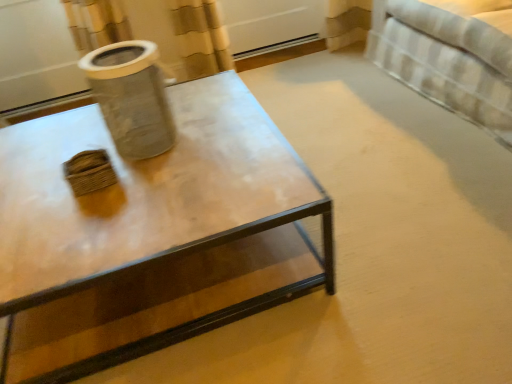
Find the location of a particular element. The height and width of the screenshot is (384, 512). white striped fabric bed at upper right is located at coordinates (450, 55).

What do you see at coordinates (450, 55) in the screenshot? I see `white striped fabric bed at upper right` at bounding box center [450, 55].

Describe the element at coordinates (151, 234) in the screenshot. This screenshot has width=512, height=384. I see `matte glass coffee table at center` at that location.

Locate an element on the screen. white striped fabric bed at upper right is located at coordinates (450, 55).

Between clear glass jar at upper left and white striped fabric bed at upper right, which one has larger size?

white striped fabric bed at upper right is bigger.

The height and width of the screenshot is (384, 512). I want to click on vase that appears on the left of white striped fabric bed at upper right, so pos(131,97).

Considering the positions of objects clear glass jar at upper left and white striped fabric bed at upper right in the image provided, who is behind, clear glass jar at upper left or white striped fabric bed at upper right?

white striped fabric bed at upper right is behind.

Is clear glass jar at upper left positioned beyond the bounds of white striped fabric bed at upper right?

Yes, clear glass jar at upper left is located beyond the bounds of white striped fabric bed at upper right.

Is matte glass coffee table at center oriented away from clear glass jar at upper left?

That's not correct — matte glass coffee table at center is not looking away from clear glass jar at upper left.

Are matte glass coffee table at center and clear glass jar at upper left beside each other?

No, matte glass coffee table at center is not with clear glass jar at upper left.

What are the coordinates of `coffee table below the clear glass jar at upper left (from a real-world perspective)` in the screenshot? It's located at (151, 234).

How many degrees apart are the facing directions of matte glass coffee table at center and clear glass jar at upper left?

There is a 0.149-degree angle between the facing directions of matte glass coffee table at center and clear glass jar at upper left.

From the image's perspective, is matte glass coffee table at center located above white striped fabric bed at upper right?

No.

Does point (101, 217) come in front of point (416, 1)?

That is True.

Considering the relative sizes of matte glass coffee table at center and white striped fabric bed at upper right in the image provided, is matte glass coffee table at center smaller than white striped fabric bed at upper right?

Yes.

Considering the relative sizes of matte glass coffee table at center and white striped fabric bed at upper right in the image provided, is matte glass coffee table at center wider than white striped fabric bed at upper right?

Indeed, matte glass coffee table at center has a greater width compared to white striped fabric bed at upper right.

Based on the photo, considering the relative sizes of white striped fabric bed at upper right and matte glass coffee table at center in the image provided, is white striped fabric bed at upper right shorter than matte glass coffee table at center?

No, white striped fabric bed at upper right is not shorter than matte glass coffee table at center.

Is white striped fabric bed at upper right smaller than matte glass coffee table at center?

No.

Does point (486, 6) come in front of point (23, 322)?

No, (486, 6) is behind (23, 322).

Does clear glass jar at upper left turn towards matte glass coffee table at center?

No, clear glass jar at upper left is not oriented towards matte glass coffee table at center.

Is clear glass jar at upper left wider than matte glass coffee table at center?

No.

Find the location of a particular element. coffee table on the right side of clear glass jar at upper left is located at coordinates (151, 234).

From the image's perspective, who appears lower, clear glass jar at upper left or matte glass coffee table at center?

matte glass coffee table at center is shown below in the image.

Is point (412, 13) behind point (133, 54)?

Yes, it is.

Measure the distance from white striped fabric bed at upper right to clear glass jar at upper left.

white striped fabric bed at upper right and clear glass jar at upper left are 4.46 feet apart.

Does white striped fabric bed at upper right come in front of clear glass jar at upper left?

No, white striped fabric bed at upper right is further to the viewer.

Is white striped fabric bed at upper right with clear glass jar at upper left?

No.

Where is `vase located in front of the white striped fabric bed at upper right`? Image resolution: width=512 pixels, height=384 pixels. vase located in front of the white striped fabric bed at upper right is located at coordinates (131, 97).

Where is `vase lying behind the matte glass coffee table at center`? vase lying behind the matte glass coffee table at center is located at coordinates (131, 97).

Looking at the image, which one is located closer to white striped fabric bed at upper right, clear glass jar at upper left or matte glass coffee table at center?

matte glass coffee table at center is positioned closer to the anchor white striped fabric bed at upper right.

When comparing their distances from white striped fabric bed at upper right, does matte glass coffee table at center or clear glass jar at upper left seem closer?

matte glass coffee table at center.

Based on their spatial positions, is matte glass coffee table at center or white striped fabric bed at upper right further from clear glass jar at upper left?

The object further to clear glass jar at upper left is white striped fabric bed at upper right.

Estimate the real-world distances between objects in this image. Which object is closer to matte glass coffee table at center, clear glass jar at upper left or white striped fabric bed at upper right?

Based on the image, clear glass jar at upper left appears to be nearer to matte glass coffee table at center.

Looking at the image, which one is located further to matte glass coffee table at center, white striped fabric bed at upper right or clear glass jar at upper left?

Based on the image, white striped fabric bed at upper right appears to be further to matte glass coffee table at center.

Which object lies nearer to the anchor point clear glass jar at upper left, white striped fabric bed at upper right or matte glass coffee table at center?

matte glass coffee table at center is closer to clear glass jar at upper left.

Image resolution: width=512 pixels, height=384 pixels. What are the coordinates of `coffee table between clear glass jar at upper left and white striped fabric bed at upper right` in the screenshot? It's located at (151, 234).